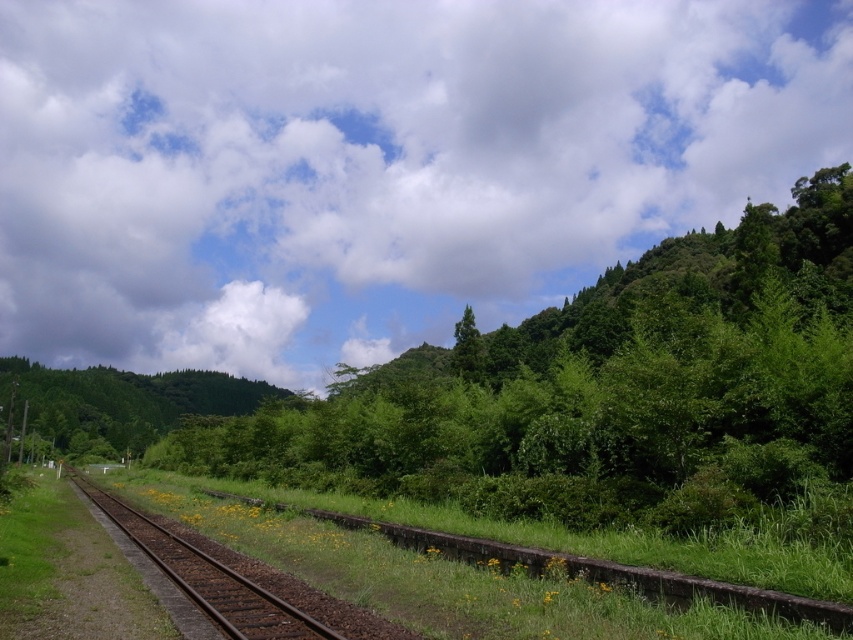
You are a hiker standing at the edge of the grassy area near the brown rusted metal track at center. You want to take a photo of the green leafy tree at upper center. Which direction should you face to ensure the tree is fully visible in your photo?

The green leafy tree at upper center is much taller than the brown rusted metal track at center, so you should face away from the track towards the upper part of the scene to capture the entire tree in your photo.

You are standing at the point marked by the coordinates point [601,392] in the image. What object is located at that point?

The green leafy tree at upper center is located at point [601,392].